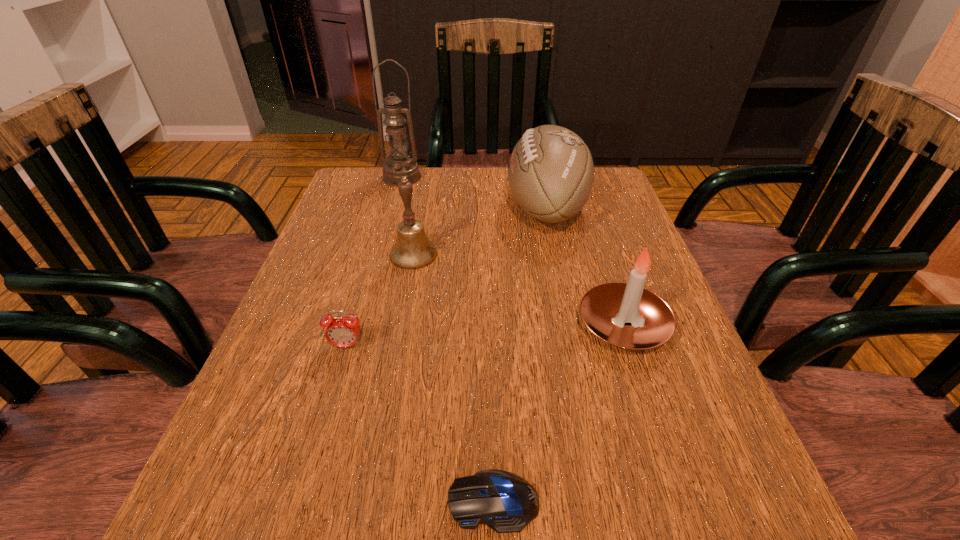
This screenshot has width=960, height=540. Identify the location of object that ranks as the fifth closest to the shortest object. (400, 165).

Find the location of a particular element. Image resolution: width=960 pixels, height=540 pixels. object that stands as the second closest to the oil lamp is located at coordinates (412, 250).

Where is `free space that satisfies the following two spatial constraints: 1. on the front side of the candle; 2. on the button side of the nearest object`? This screenshot has height=540, width=960. free space that satisfies the following two spatial constraints: 1. on the front side of the candle; 2. on the button side of the nearest object is located at coordinates (682, 501).

Image resolution: width=960 pixels, height=540 pixels. I want to click on vacant area in the image that satisfies the following two spatial constraints: 1. on the front side of the candle; 2. on the button side of the nearest object, so click(x=682, y=501).